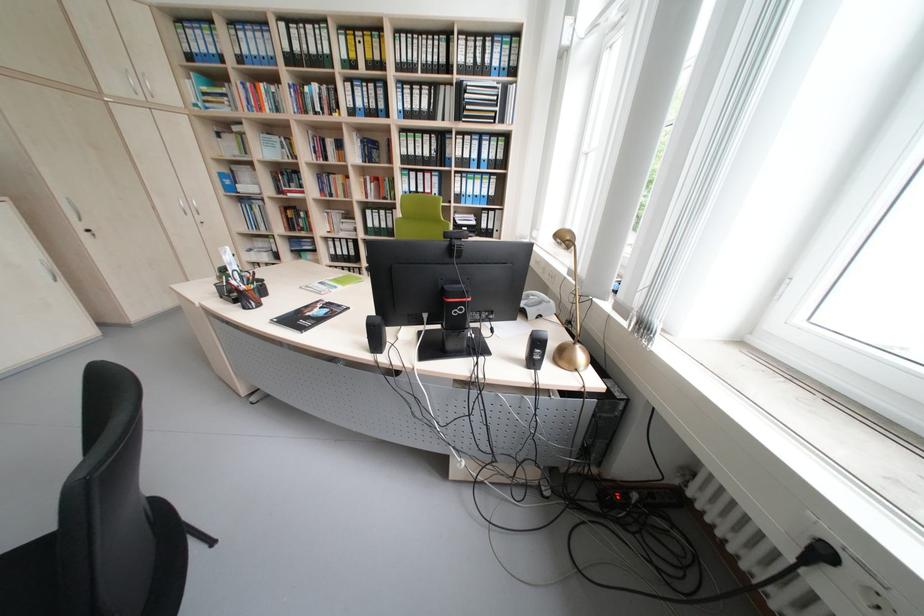
Find where to adjust the black webcam. Please return your answer as a coordinate pair (x, y).

(459, 229)